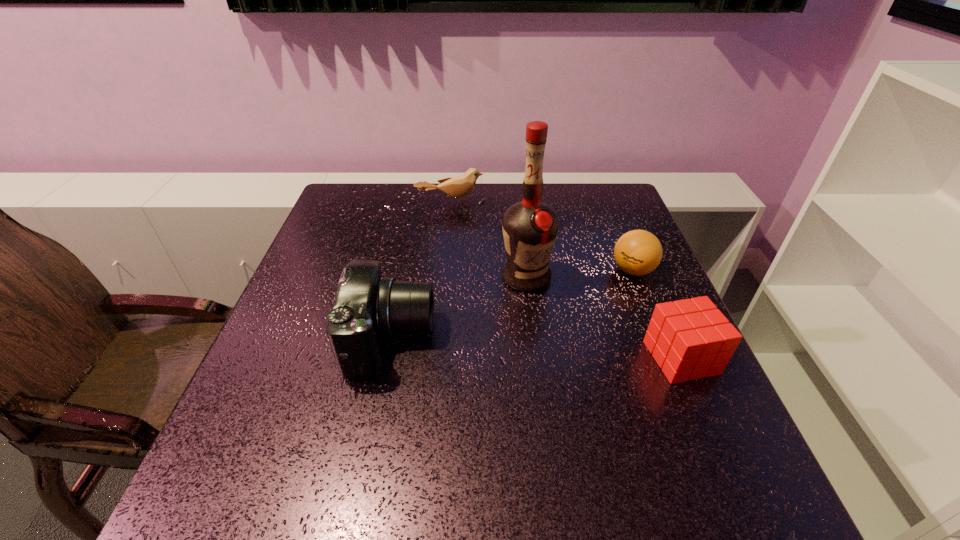
I want to click on free space at the far edge of the desktop, so click(x=501, y=221).

The image size is (960, 540). Identify the location of vacant region at the near edge of the desktop. (436, 438).

Find the location of `vacant space at the left edge of the desktop`. vacant space at the left edge of the desktop is located at coordinates (364, 234).

Image resolution: width=960 pixels, height=540 pixels. Identify the location of vacant space at the right edge of the desktop. (606, 280).

This screenshot has height=540, width=960. I want to click on vacant space at the far left corner of the desktop, so click(370, 222).

The height and width of the screenshot is (540, 960). What are the coordinates of `vacant space at the near left corner` in the screenshot? It's located at (267, 453).

What are the coordinates of `blank space at the far right corner` in the screenshot? It's located at 603,204.

Image resolution: width=960 pixels, height=540 pixels. What are the coordinates of `free space between the cube and the third object from right to left` in the screenshot? It's located at (603, 318).

Where is `unoccupied area between the camera and the cube`? The height and width of the screenshot is (540, 960). unoccupied area between the camera and the cube is located at coordinates (536, 348).

Locate an element on the screen. The image size is (960, 540). vacant space that's between the cube and the tallest object is located at coordinates (603, 318).